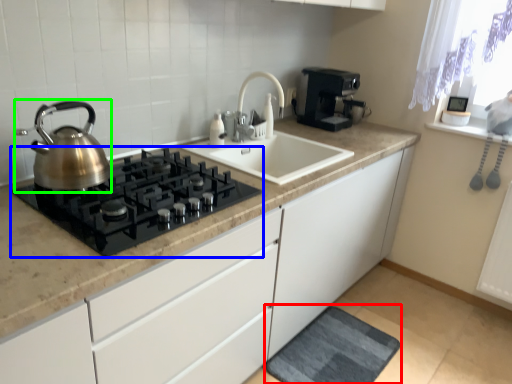
Question: Which object is positioned farthest from bath mat (highlighted by a red box)? Select from gas stove (highlighted by a blue box) and kettle (highlighted by a green box).

Choices:
 (A) gas stove
 (B) kettle

Answer: (B)